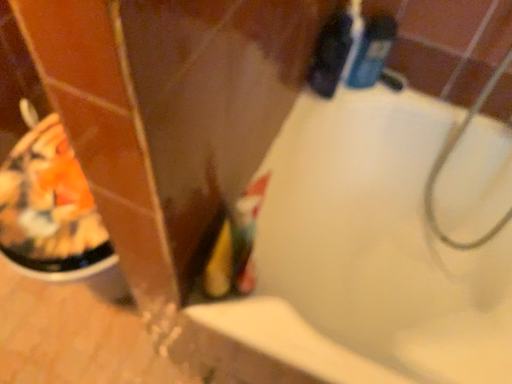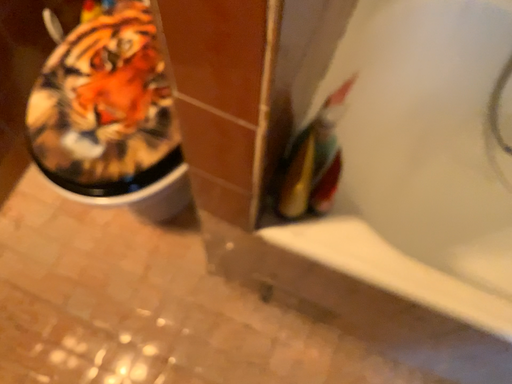
Question: Which way did the camera rotate in the video?

Choices:
 (A) rotated downward
 (B) rotated upward

Answer: (A)